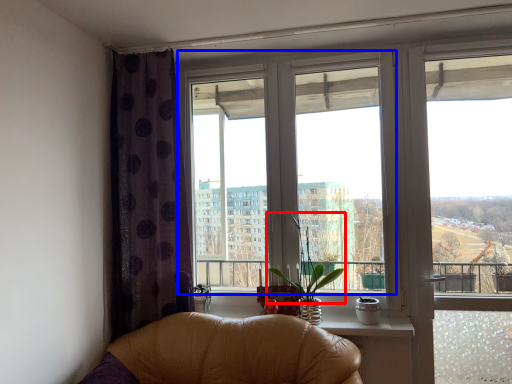
Question: Which object is further to the camera taking this photo, plant (highlighted by a red box) or window (highlighted by a blue box)?

Choices:
 (A) plant
 (B) window

Answer: (B)